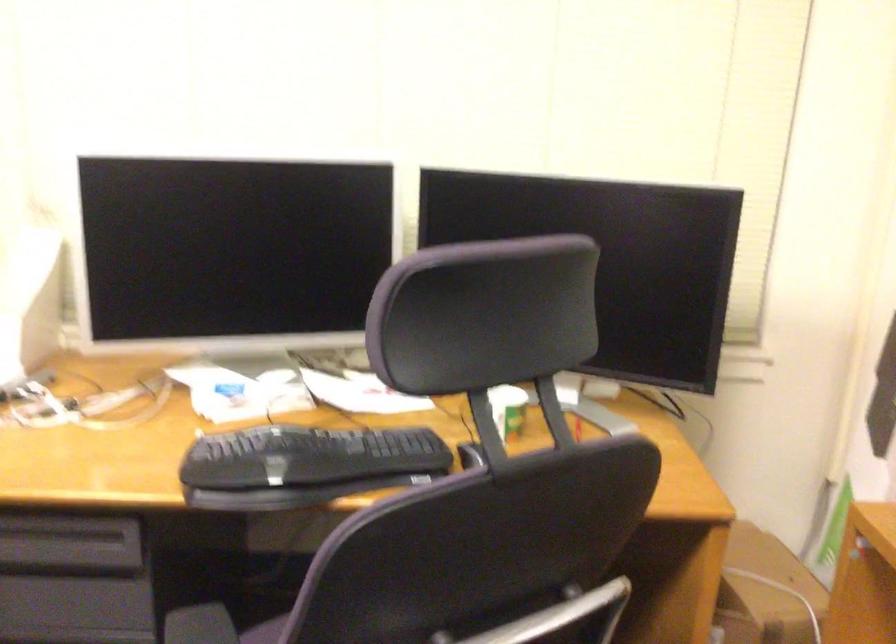
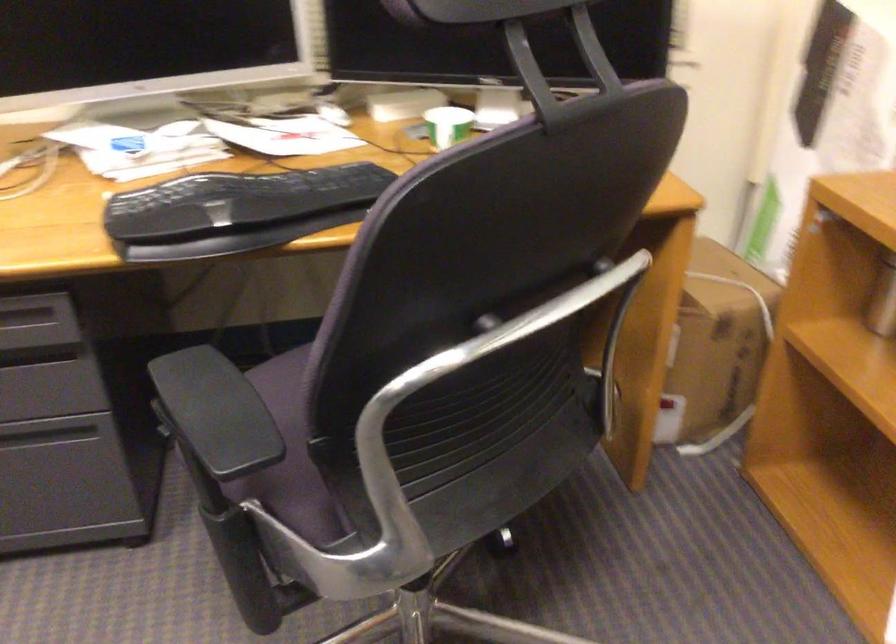
In a continuous first-person perspective shot, in which direction is the camera moving?

The movement direction of the cameraman is left, forward.